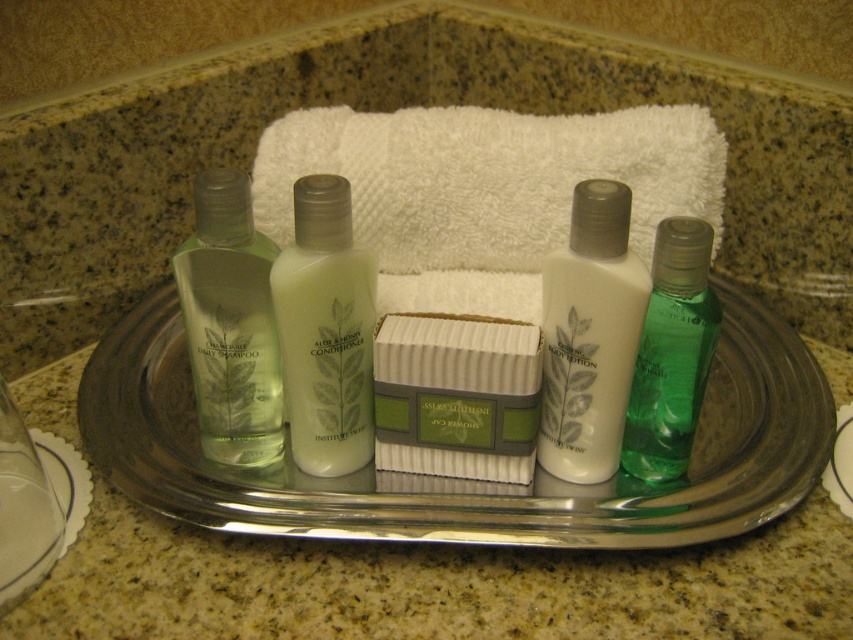
You are a guest staying in a hotel room and see the white matte conditioner at center and the green matte daily shampoo at left on the glass tray. Which product is positioned lower on the tray?

The white matte conditioner at center is positioned lower than the green matte daily shampoo at left on the tray.

You are standing in front of the glass tray with toiletries. Where is the white striped soap at center located relative to the other items on the tray?

The white striped soap at center is located at point 0.619 on the x axis and 0.536 on the y axis.